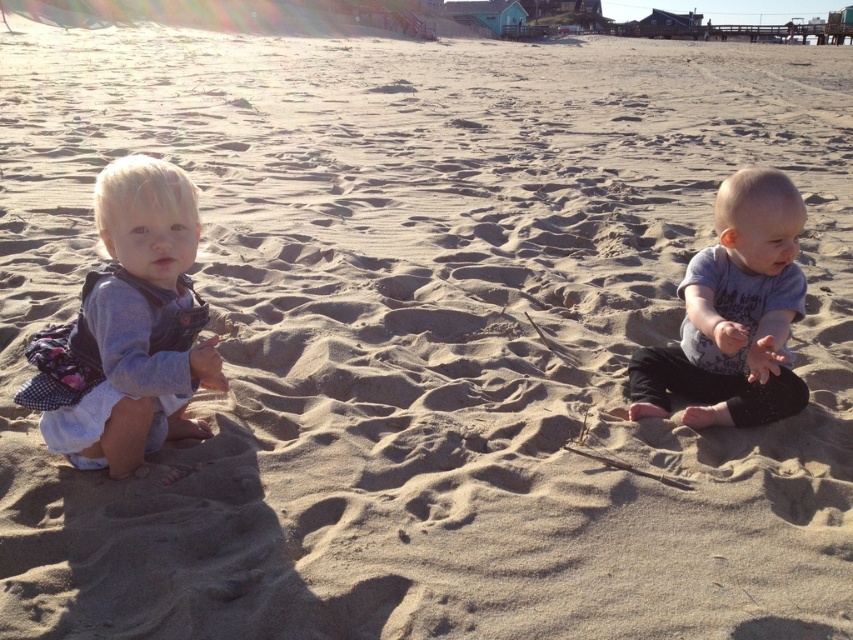
Between matte gray vest at left and light blue cotton shirt at center, which one appears on the left side from the viewer's perspective?

matte gray vest at left is more to the left.

Does matte gray vest at left appear under light blue cotton shirt at center?

Yes.

Between point (193, 214) and point (633, 397), which one is positioned in front?

Point (193, 214) is in front.

I want to click on matte gray vest at left, so click(131, 330).